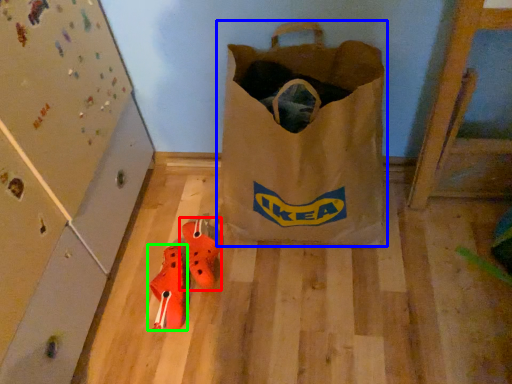
Question: Which object is the closest to the footwear (highlighted by a red box)? Choose among these: luggage and bags (highlighted by a blue box) or footwear (highlighted by a green box).

Choices:
 (A) luggage and bags
 (B) footwear

Answer: (B)